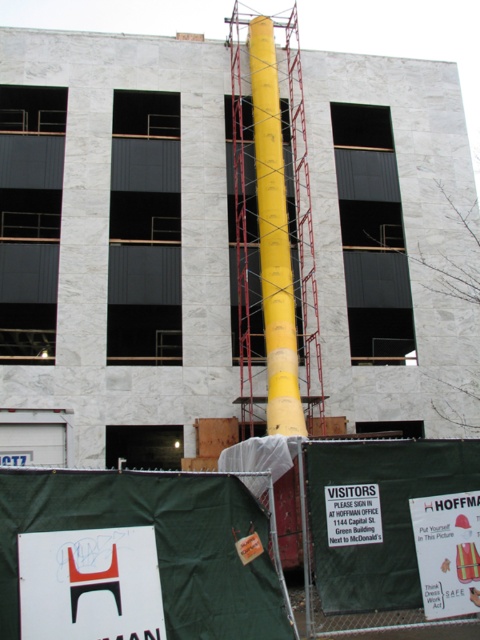
You are standing at the origin point in the image. Where is the yellow smooth pole at center located in terms of coordinates?

The yellow smooth pole at center is located at coordinates point (115,244).

You are an inspector at the construction site. You need to determine the vertical relationship between the yellow smooth pole at center and the yellow plastic pipe at center. Which one is higher?

The yellow smooth pole at center is higher than the yellow plastic pipe at center because it is positioned above it.

You are a visitor arriving at the construction site and need to locate the matte white sign at lower left. According to the scene description, where should you look to find it?

The matte white sign at lower left is located at point (90, 584).